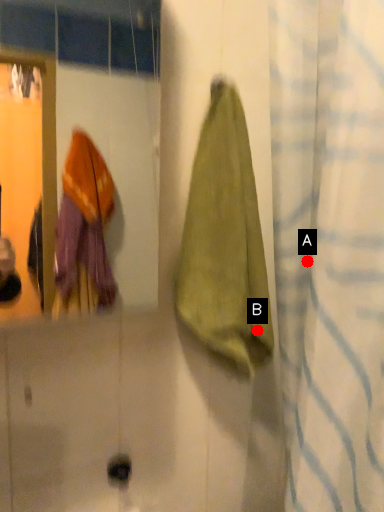
Question: Two points are circled on the image, labeled by A and B beside each circle. Among these points, which one is nearest to the camera?

Choices:
 (A) A is closer
 (B) B is closer

Answer: (B)